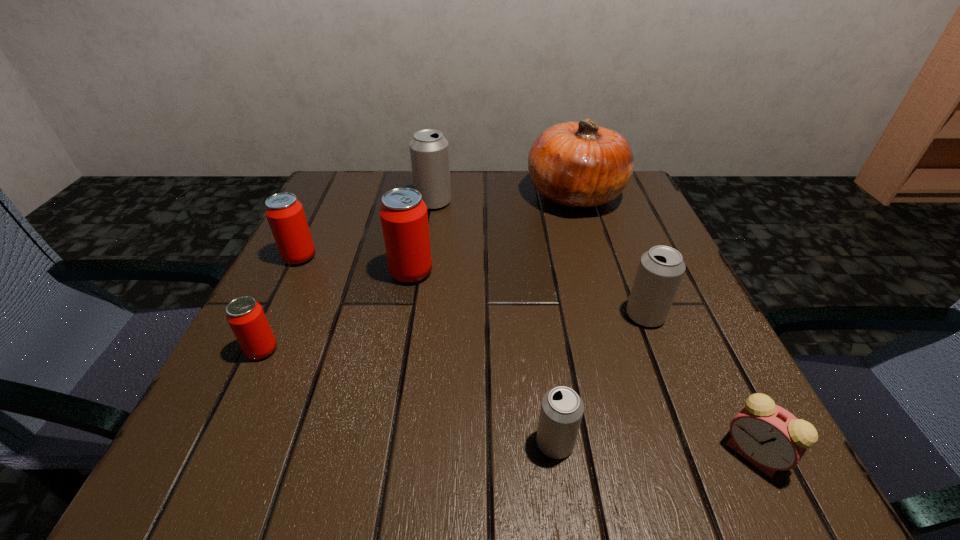
This screenshot has width=960, height=540. I want to click on pumpkin, so click(x=580, y=164).

Locate an element on the screen. The image size is (960, 540). the leftmost white beer can is located at coordinates coord(429,150).

This screenshot has width=960, height=540. In order to click on the farthest beer can in this screenshot , I will do `click(429, 150)`.

Locate an element on the screen. the rightmost red beer can is located at coordinates (404, 218).

Locate an element on the screen. The image size is (960, 540). the rightmost beer can is located at coordinates (660, 271).

Locate an element on the screen. the fourth nearest object is located at coordinates (660, 271).

Image resolution: width=960 pixels, height=540 pixels. What are the coordinates of `the second smallest red beer can` in the screenshot? It's located at (285, 214).

Locate an element on the screen. The image size is (960, 540). the nearest red beer can is located at coordinates (245, 316).

You are a GUI agent. You are given a task and a screenshot of the screen. Output one action in this format:
    pyautogui.click(x=<x>, y=<y>)
    Task: Click on the sixth farthest object
    The image size is (960, 540).
    Given the screenshot: What is the action you would take?
    pyautogui.click(x=245, y=316)

Find the location of a particular element. The width and height of the screenshot is (960, 540). the fifth beer can from left to right is located at coordinates (561, 412).